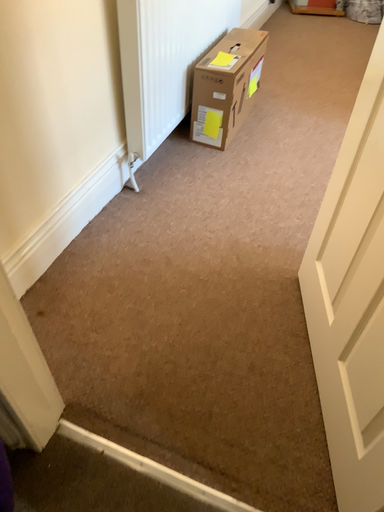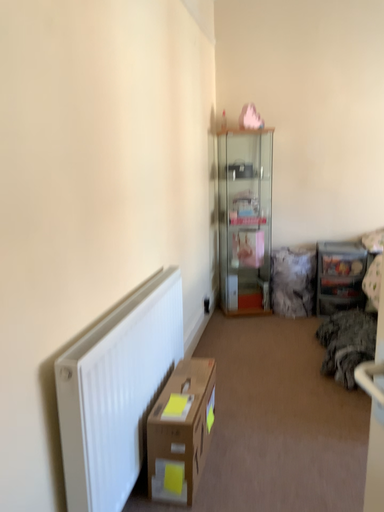
Question: How did the camera likely rotate when shooting the video?

Choices:
 (A) rotated upward
 (B) rotated downward

Answer: (A)